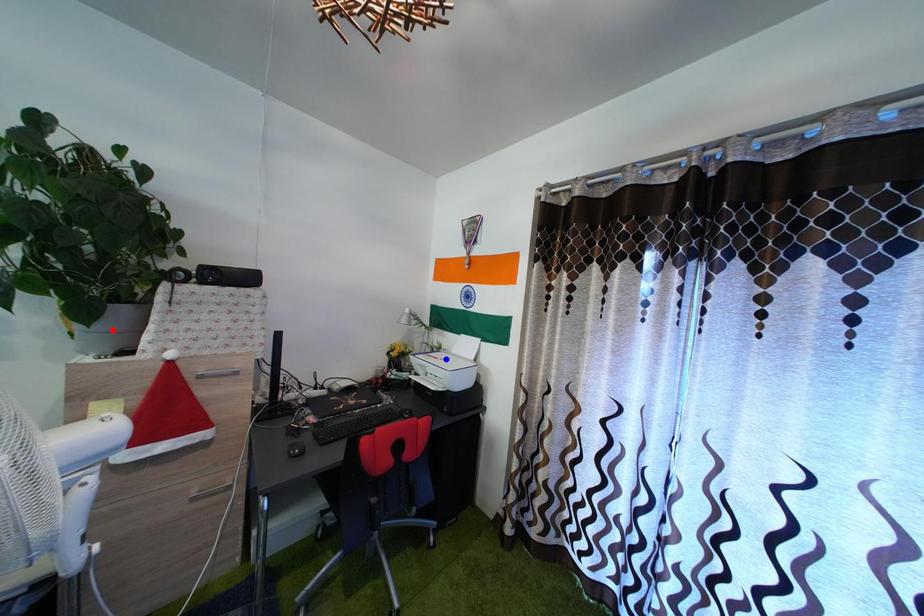
Question: Which of the two points in the image is closer to the camera?

Choices:
 (A) Blue point is closer.
 (B) Red point is closer.

Answer: (B)